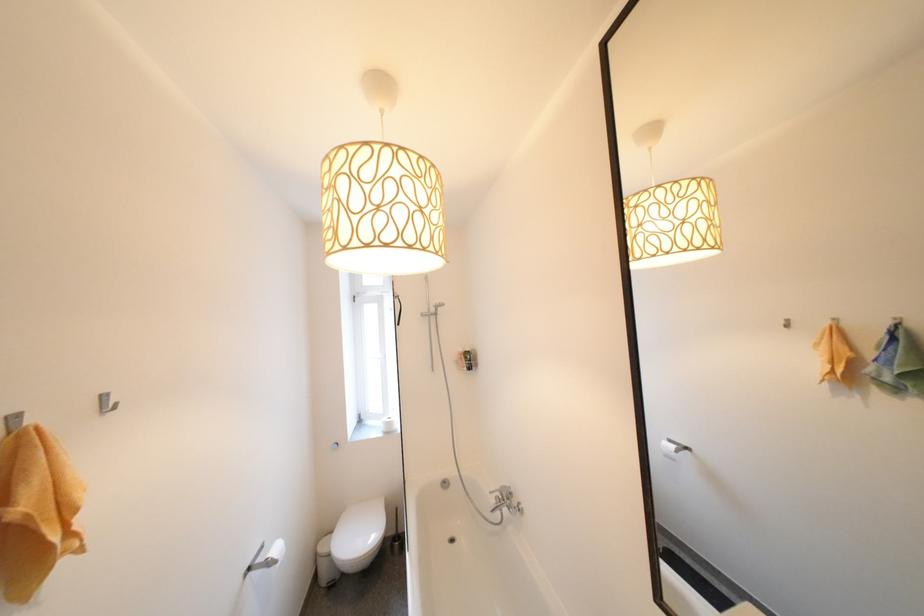
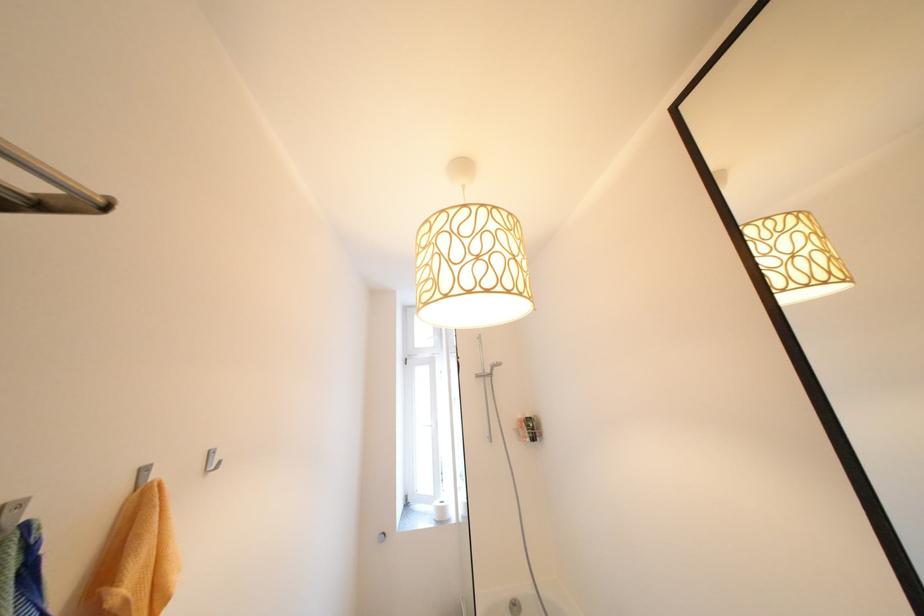
The point at (475, 366) is marked in the first image. Where is the corresponding point in the second image?

(537, 436)